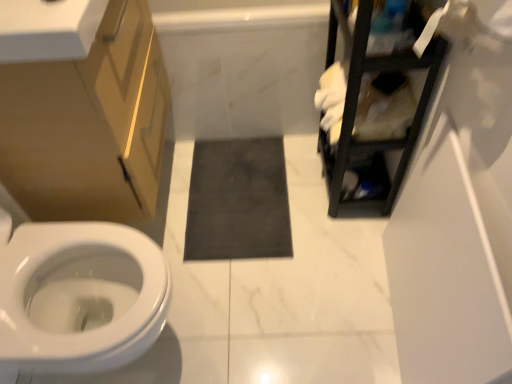
At what (x,y) coordinates should I click in order to perform the action: click on blank space situated above dark gray matte bath mat at center (from a real-world perspective). Please return your answer as a coordinate pair (x, y). The width and height of the screenshot is (512, 384). Looking at the image, I should click on (238, 195).